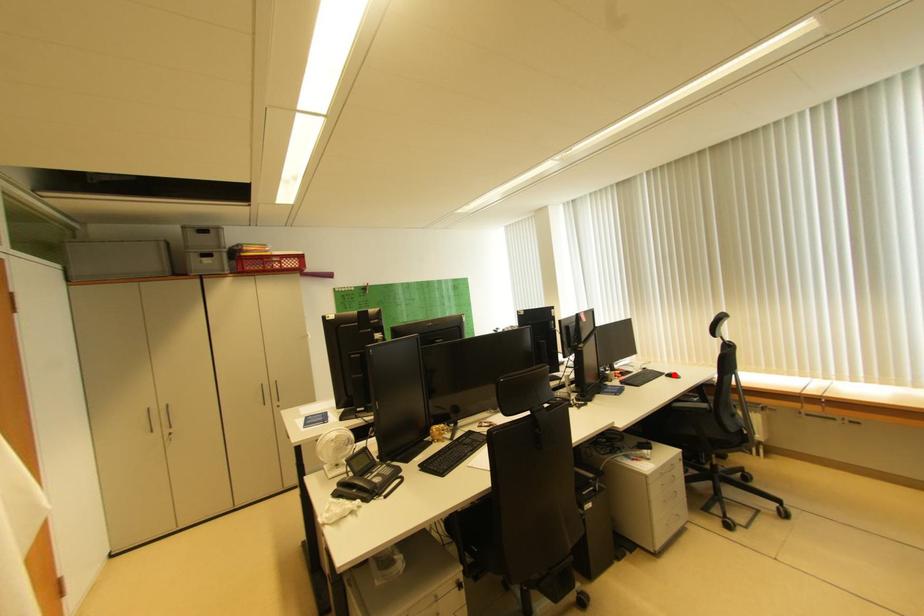
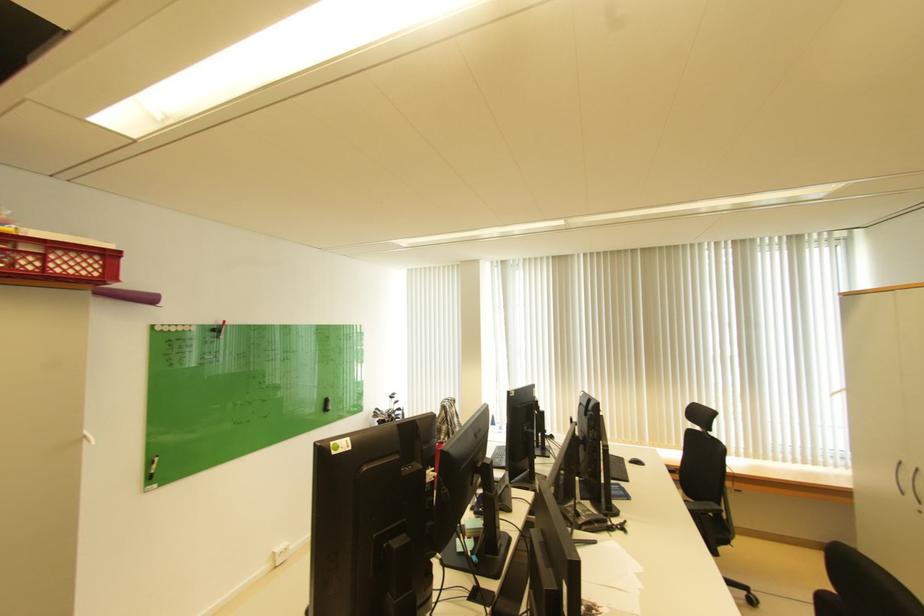
Question: A red point is marked in image1. In image2, is the corresponding 3D point closer to the camera or farther? Reply with the corresponding letter.

Choices:
 (A) The corresponding 3D point is closer.
 (B) The corresponding 3D point is farther.

Answer: (A)